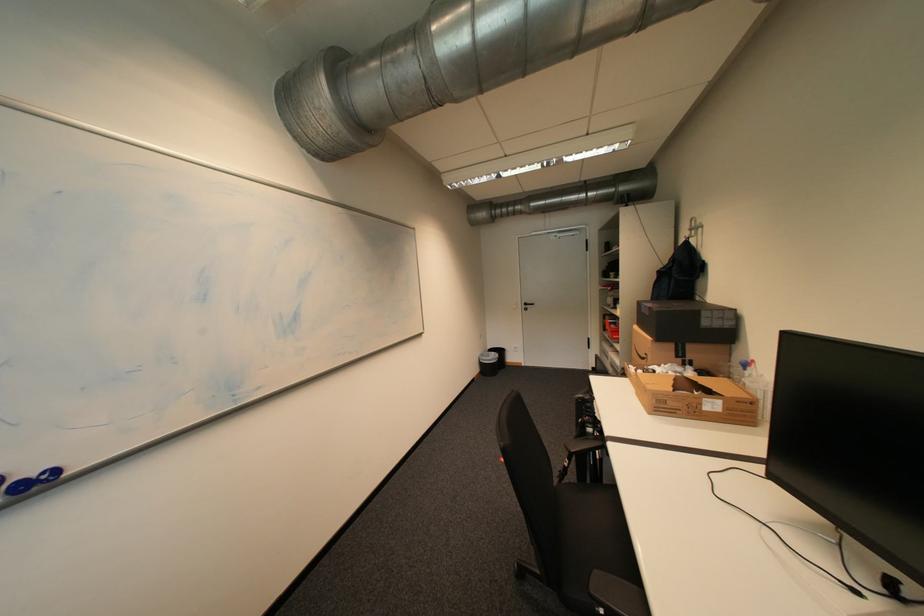
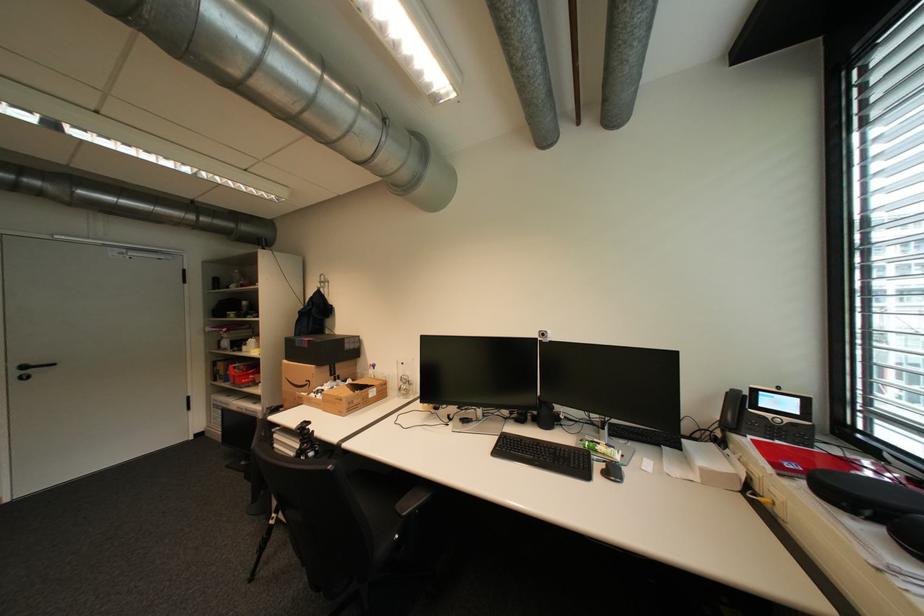
Find the pixel in the second image that matches point (666, 272) in the first image.

(308, 312)